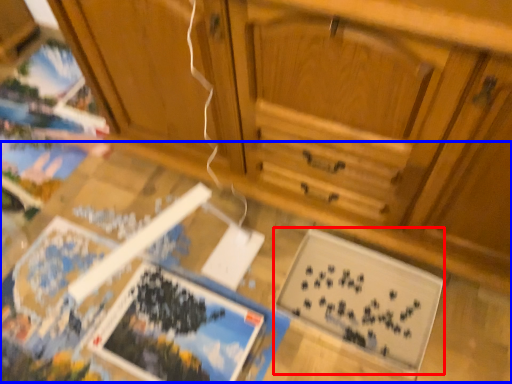
Question: Which object appears farthest to the camera in this image, magazine (highlighted by a red box) or table (highlighted by a blue box)?

Choices:
 (A) magazine
 (B) table

Answer: (A)